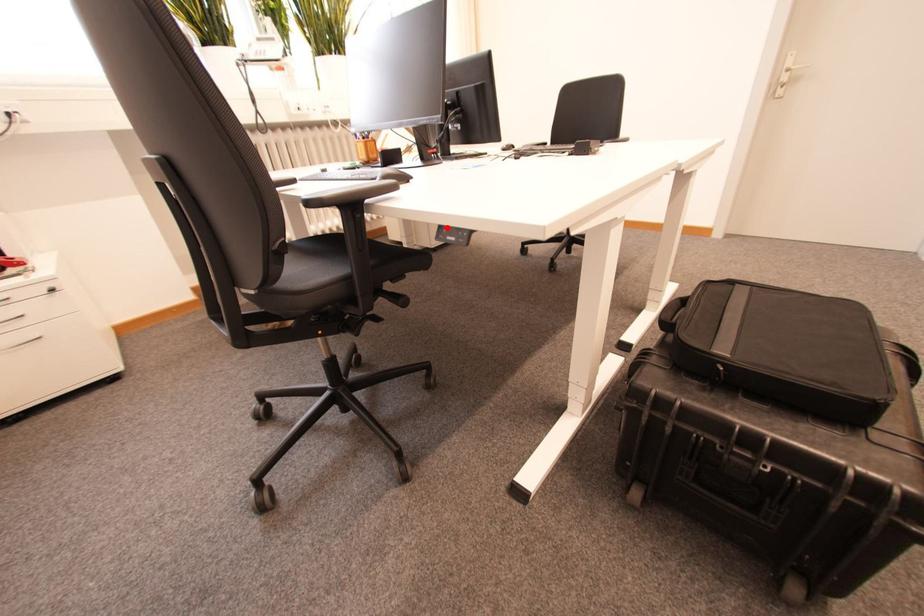
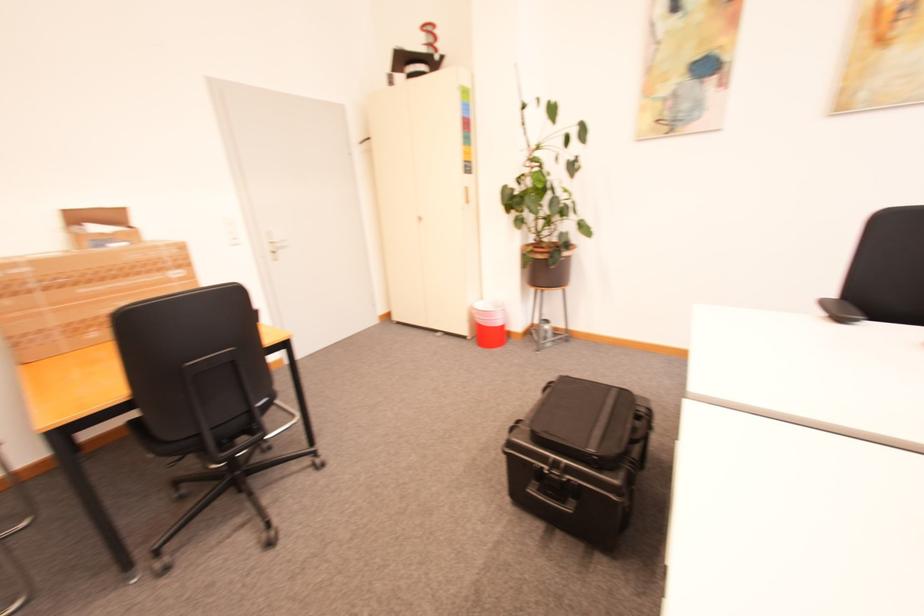
Question: I am providing you with two images of the same scene from different viewpoints. A red point is marked on the first image. Is the red point's position out of view in image 2?

Choices:
 (A) Yes
 (B) No

Answer: (A)